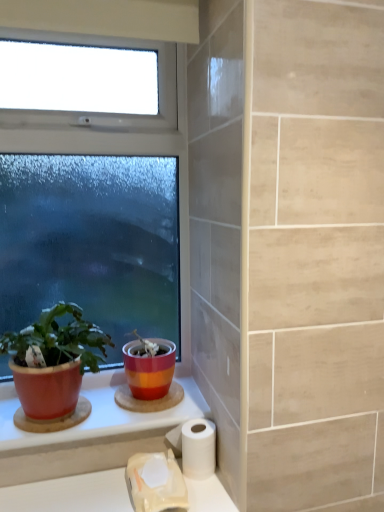
Question: In terms of size, does white matte toilet paper at lower center, which ranks as the 1th toilet paper in left-to-right order, appear bigger or smaller than matte ceramic counter top at lower left?

Choices:
 (A) small
 (B) big

Answer: (A)

Question: Considering the positions of white matte toilet paper at lower center, acting as the 2th toilet paper starting from the right, and matte ceramic counter top at lower left in the image, is white matte toilet paper at lower center, acting as the 2th toilet paper starting from the right, wider or thinner than matte ceramic counter top at lower left?

Choices:
 (A) thin
 (B) wide

Answer: (A)

Question: Estimate the real-world distances between objects in this image. Which object is farther from the matte red pot at left?

Choices:
 (A) clear glass window at upper left
 (B) matte ceramic pot at center
 (C) matte ceramic counter top at lower left
 (D) white matte toilet paper at lower center, acting as the 2th toilet paper starting from the right
 (E) white matte toilet paper at lower center, arranged as the 2th toilet paper when viewed from the left

Answer: (A)

Question: Which of these objects is positioned closest to the clear glass window at upper left?

Choices:
 (A) matte red pot at left
 (B) white matte toilet paper at lower center, arranged as the 2th toilet paper when viewed from the left
 (C) matte ceramic counter top at lower left
 (D) matte ceramic pot at center
 (E) white matte toilet paper at lower center, which ranks as the 1th toilet paper in left-to-right order

Answer: (D)